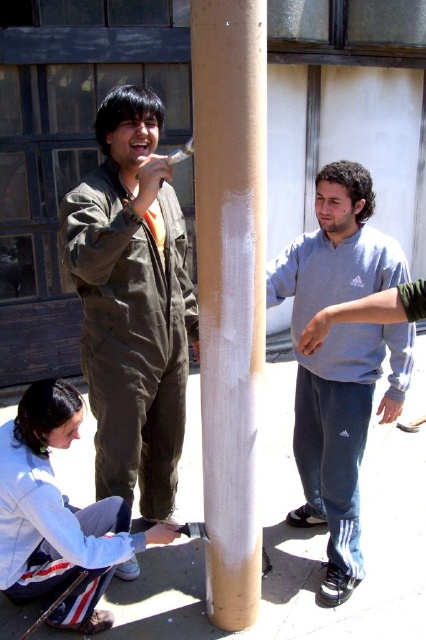
Consider the image. Which is above, smooth concrete pavement at lower center or matte green jumpsuit at center?

matte green jumpsuit at center is higher up.

Where is `smooth concrete pavement at lower center`? This screenshot has width=426, height=640. smooth concrete pavement at lower center is located at coordinates (302, 548).

Is smooth concrete pavement at lower center below smooth brown pole at center?

Yes.

In the scene shown: Is smooth concrete pavement at lower center to the left of smooth brown pole at center from the viewer's perspective?

In fact, smooth concrete pavement at lower center is to the right of smooth brown pole at center.

Does point (367, 508) come in front of point (244, 467)?

No.

The width and height of the screenshot is (426, 640). What are the coordinates of `smooth concrete pavement at lower center` in the screenshot? It's located at (302, 548).

Between smooth brown pole at center and matte green jumpsuit at center, which one appears on the right side from the viewer's perspective?

smooth brown pole at center is more to the right.

Who is higher up, smooth brown pole at center or matte green jumpsuit at center?

matte green jumpsuit at center is above.

The image size is (426, 640). What do you see at coordinates (230, 291) in the screenshot?
I see `smooth brown pole at center` at bounding box center [230, 291].

Locate an element on the screen. This screenshot has width=426, height=640. smooth brown pole at center is located at coordinates (230, 291).